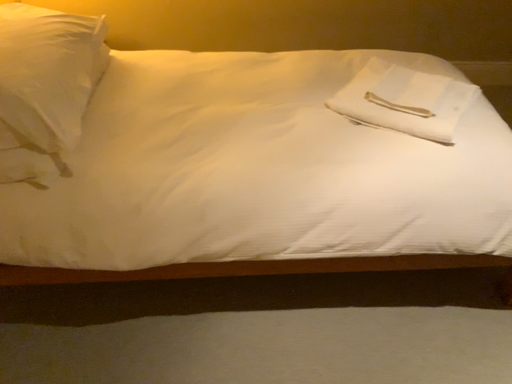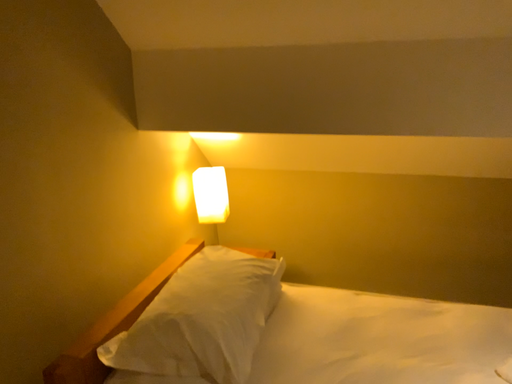
Question: Which way did the camera rotate in the video?

Choices:
 (A) rotated left
 (B) rotated right

Answer: (A)